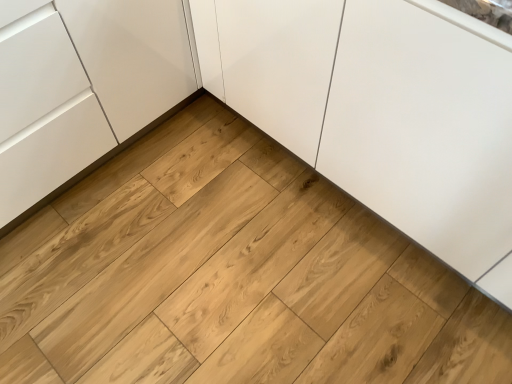
What is the approximate height of natural wood cabinetry at center?

It is 72.43 centimeters.

Locate an element on the screen. This screenshot has width=512, height=384. natural wood cabinetry at center is located at coordinates (102, 95).

What do you see at coordinates (102, 95) in the screenshot?
I see `natural wood cabinetry at center` at bounding box center [102, 95].

Where is `natural wood cabinetry at center`? Image resolution: width=512 pixels, height=384 pixels. natural wood cabinetry at center is located at coordinates pos(102,95).